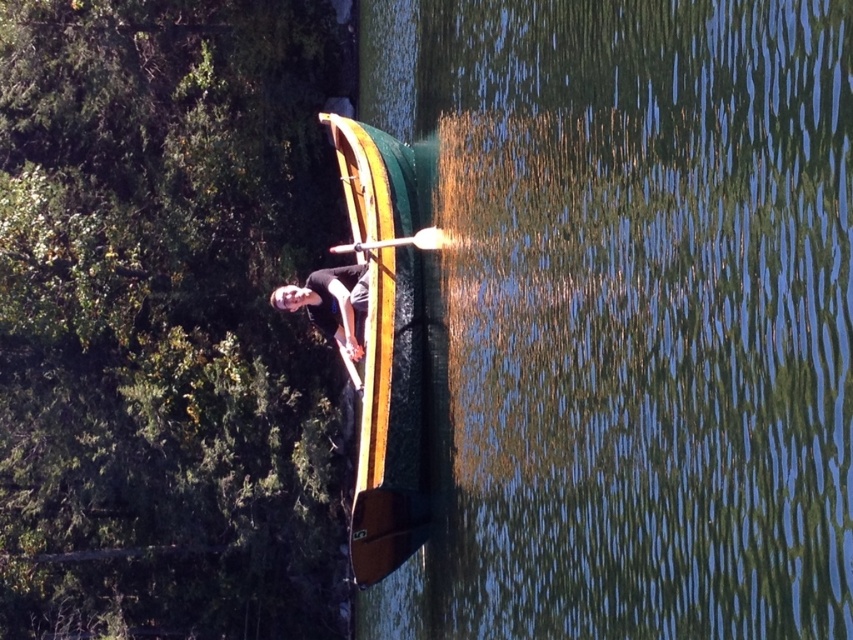
Question: Which point is farther to the camera?

Choices:
 (A) wooden paddle at center
 (B) green polished wood boat at center
 (C) matte black shirt at center

Answer: (C)

Question: Among these objects, which one is farthest from the camera?

Choices:
 (A) wooden paddle at center
 (B) green polished wood boat at center
 (C) green leafy tree at upper left

Answer: (C)

Question: Does green leafy tree at upper left have a lesser width compared to green polished wood boat at center?

Choices:
 (A) no
 (B) yes

Answer: (A)

Question: Which of these objects is positioned closest to the matte black shirt at center?

Choices:
 (A) wooden paddle at center
 (B) green leafy tree at upper left

Answer: (A)

Question: Is green leafy tree at upper left bigger than green polished wood boat at center?

Choices:
 (A) no
 (B) yes

Answer: (B)

Question: Is green smooth water at center thinner than wooden paddle at center?

Choices:
 (A) no
 (B) yes

Answer: (B)